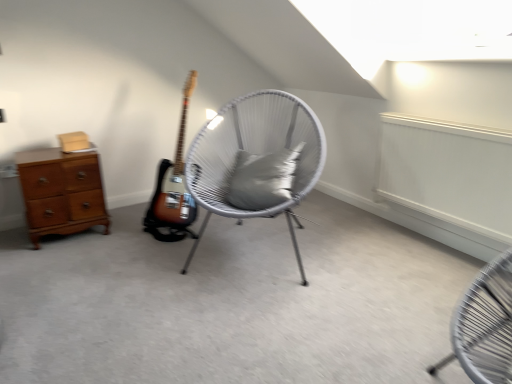
At what (x,y) coordinates should I click in order to perform the action: click on free space in front of white woven chair at center. Please return your answer as a coordinate pair (x, y). Looking at the image, I should click on (261, 317).